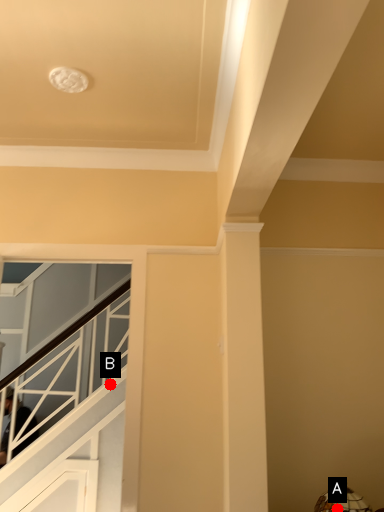
Question: Two points are circled on the image, labeled by A and B beside each circle. Which of the following is the farthest from the observer?

Choices:
 (A) A is further
 (B) B is further

Answer: (B)